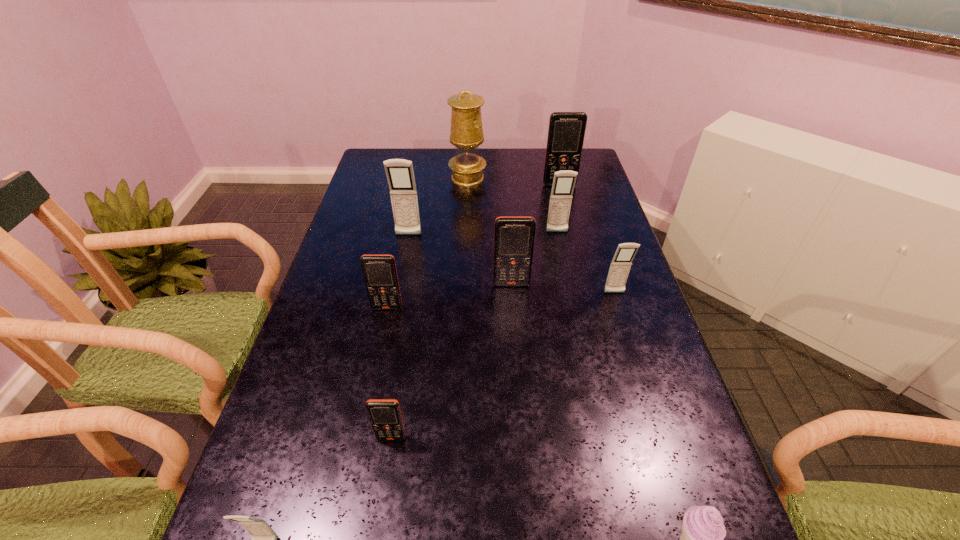
Locate an element on the screen. This screenshot has height=540, width=960. vacant space that is in between the seventh farthest object and the biggest gray cellular telephone is located at coordinates (397, 272).

Identify the location of free point between the fourth nearest object and the fifth farthest object. (449, 296).

Find the location of a particular element. This screenshot has width=960, height=540. object that stands as the eighth closest to the farthest orange cellular telephone is located at coordinates coord(702,539).

The width and height of the screenshot is (960, 540). Find the location of `object that stands as the third closest to the smallest orange cellular telephone`. object that stands as the third closest to the smallest orange cellular telephone is located at coordinates (514, 236).

Locate which cellular telephone is the third closest to the farthest cellular telephone. Please provide its 2D coordinates. Your answer should be formatted as a tuple, i.e. [(x, y)], where the tuple contains the x and y coordinates of a point satisfying the conditions above.

[(514, 236)]

You are a GUI agent. You are given a task and a screenshot of the screen. Output one action in this format:
    pyautogui.click(x=<x>, y=<y>)
    Task: Click on the second closest cellular telephone to the purple icecream
    The image size is (960, 540).
    Given the screenshot: What is the action you would take?
    pyautogui.click(x=621, y=263)

In order to click on orange cellular telephone that is the third closest to the second biggest orange cellular telephone in this screenshot , I will do `click(566, 131)`.

Choose which orange cellular telephone is the nearest neighbor to the third nearest object. Please provide its 2D coordinates. Your answer should be formatted as a tuple, i.e. [(x, y)], where the tuple contains the x and y coordinates of a point satisfying the conditions above.

[(379, 271)]

Choose which gray cellular telephone is the third nearest neighbor to the second nearest cellular telephone. Please provide its 2D coordinates. Your answer should be formatted as a tuple, i.e. [(x, y)], where the tuple contains the x and y coordinates of a point satisfying the conditions above.

[(400, 175)]

Locate which gray cellular telephone ranks in proximity to the second smallest orange cellular telephone. Please provide its 2D coordinates. Your answer should be formatted as a tuple, i.e. [(x, y)], where the tuple contains the x and y coordinates of a point satisfying the conditions above.

[(400, 175)]